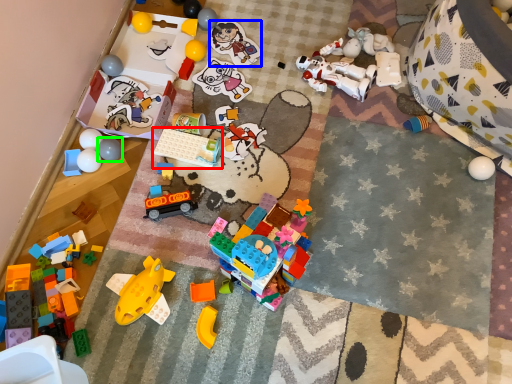
Question: Estimate the real-world distances between objects in this image. Which object is closer to toy (highlighted by a red box), toy (highlighted by a blue box) or toy (highlighted by a green box)?

Choices:
 (A) toy
 (B) toy

Answer: (B)